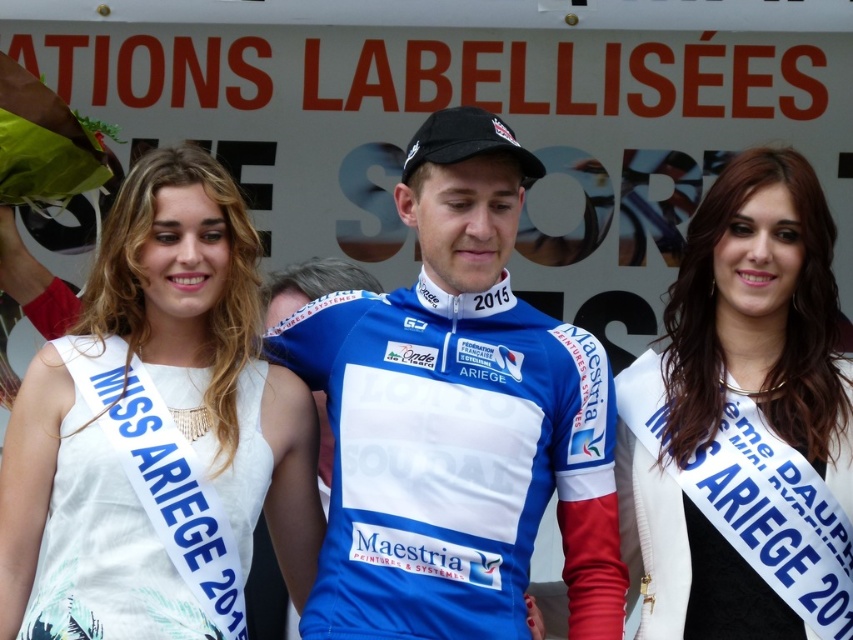
Question: Can you confirm if white satin sash at right is positioned below white fabric dress at center?

Choices:
 (A) yes
 (B) no

Answer: (B)

Question: Which point is farther from the camera taking this photo?

Choices:
 (A) (44, 438)
 (B) (636, 440)
 (C) (581, 566)
 (D) (242, 445)

Answer: (B)

Question: Estimate the real-world distances between objects in this image. Which object is farther from the white fabric dress at center?

Choices:
 (A) white satin sash at right
 (B) blue jersey at center

Answer: (A)

Question: Does white satin sash at left lie behind white fabric dress at center?

Choices:
 (A) yes
 (B) no

Answer: (B)

Question: Which point appears farthest from the camera in this image?

Choices:
 (A) (73, 570)
 (B) (648, 400)

Answer: (B)

Question: Does blue jersey at center appear on the left side of white satin sash at left?

Choices:
 (A) yes
 (B) no

Answer: (B)